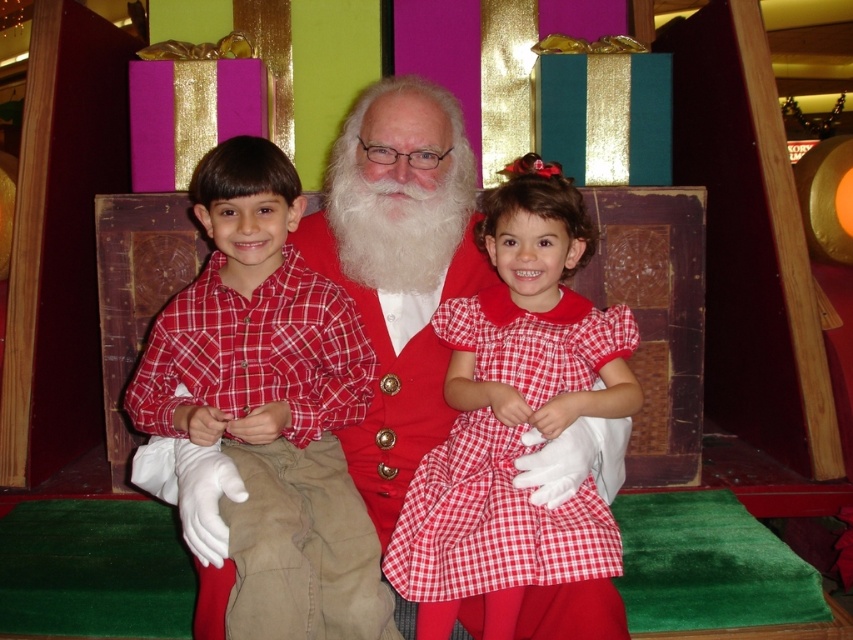
Question: Is red plaid shirt at center to the left of red checkered dress at center from the viewer's perspective?

Choices:
 (A) yes
 (B) no

Answer: (A)

Question: Is red plaid shirt at center closer to camera compared to red checkered dress at center?

Choices:
 (A) yes
 (B) no

Answer: (A)

Question: Can you confirm if red plaid shirt at center is wider than red checkered dress at center?

Choices:
 (A) no
 (B) yes

Answer: (B)

Question: Which point is farther to the camera?

Choices:
 (A) red checkered dress at center
 (B) red plaid shirt at center

Answer: (A)

Question: Among these objects, which one is nearest to the camera?

Choices:
 (A) red checkered dress at center
 (B) red plaid shirt at center

Answer: (B)